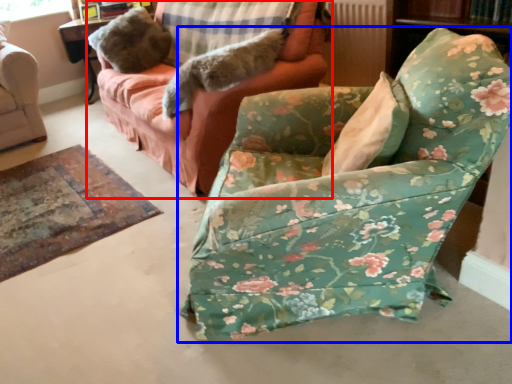
Question: Which object appears farthest to the camera in this image, studio couch (highlighted by a red box) or chair (highlighted by a blue box)?

Choices:
 (A) studio couch
 (B) chair

Answer: (A)